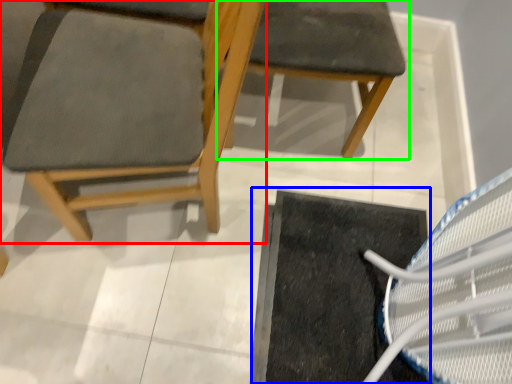
Question: Estimate the real-world distances between objects in this image. Which object is farther from chair (highlighted by a red box), doormat (highlighted by a blue box) or chair (highlighted by a green box)?

Choices:
 (A) doormat
 (B) chair

Answer: (A)